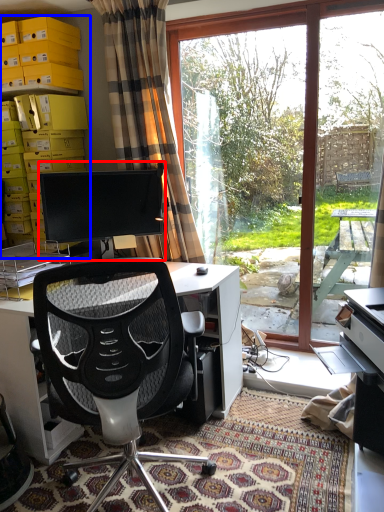
Question: Which of the following is the farthest to the observer, computer monitor (highlighted by a red box) or shelf (highlighted by a blue box)?

Choices:
 (A) computer monitor
 (B) shelf

Answer: (B)